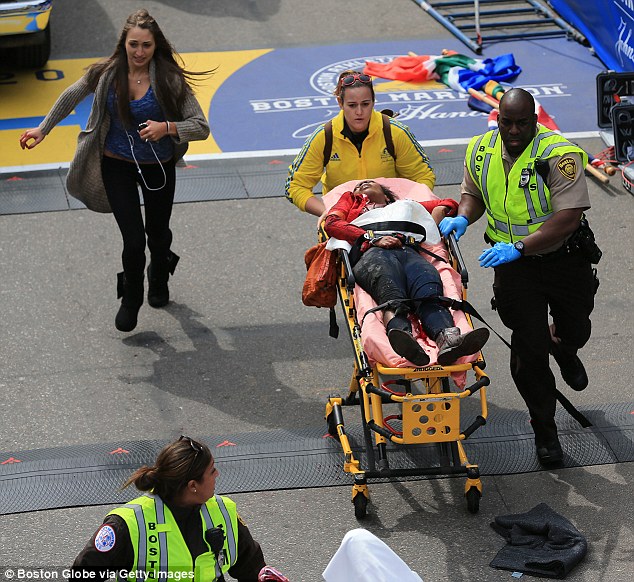
Where is `cable covers`? The image size is (634, 582). cable covers is located at coordinates (250, 461), (59, 475), (512, 457).